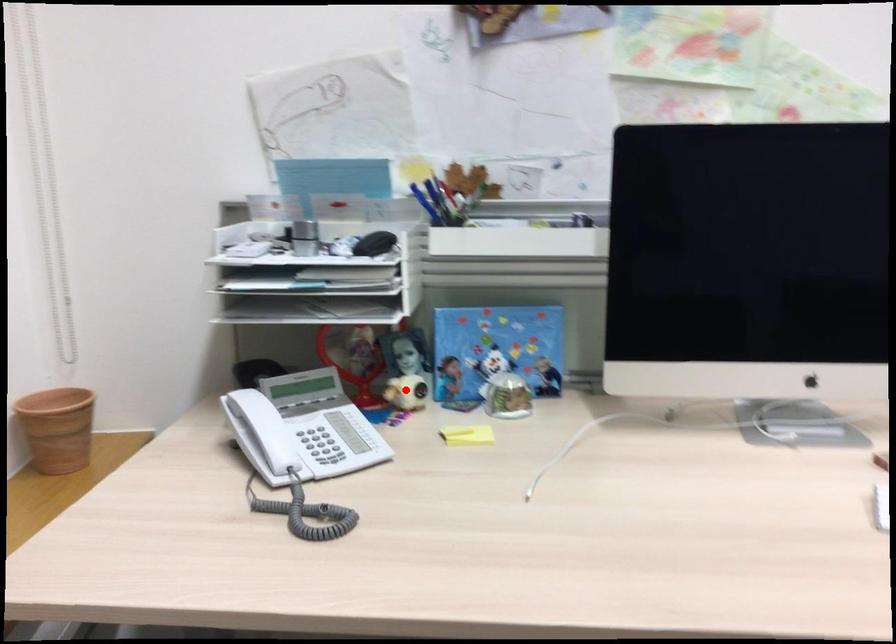
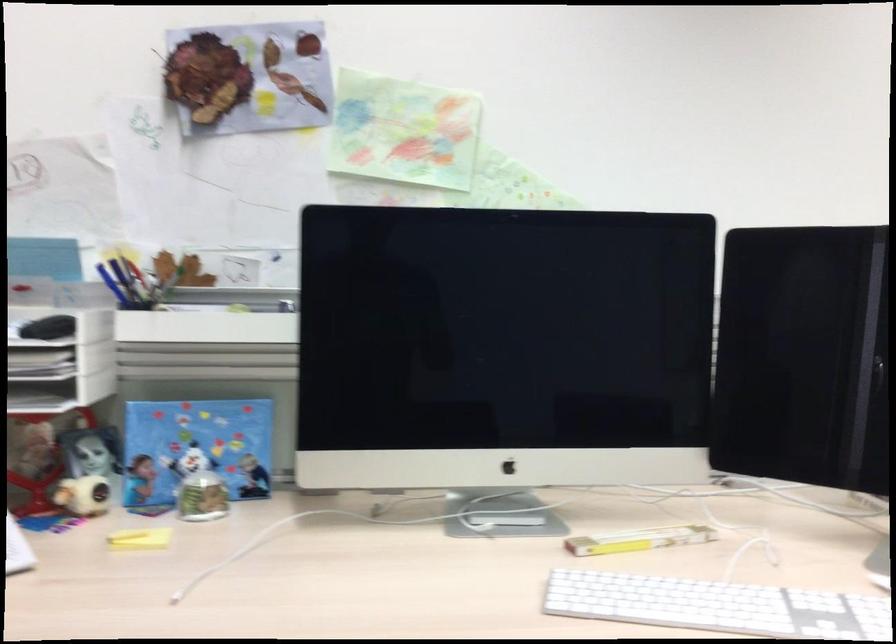
Question: I am providing you with two images of the same scene from different viewpoints. Given a red point in image1, look at the same physical point in image2. Is it:

Choices:
 (A) Closer to the viewpoint
 (B) Farther from the viewpoint

Answer: (A)